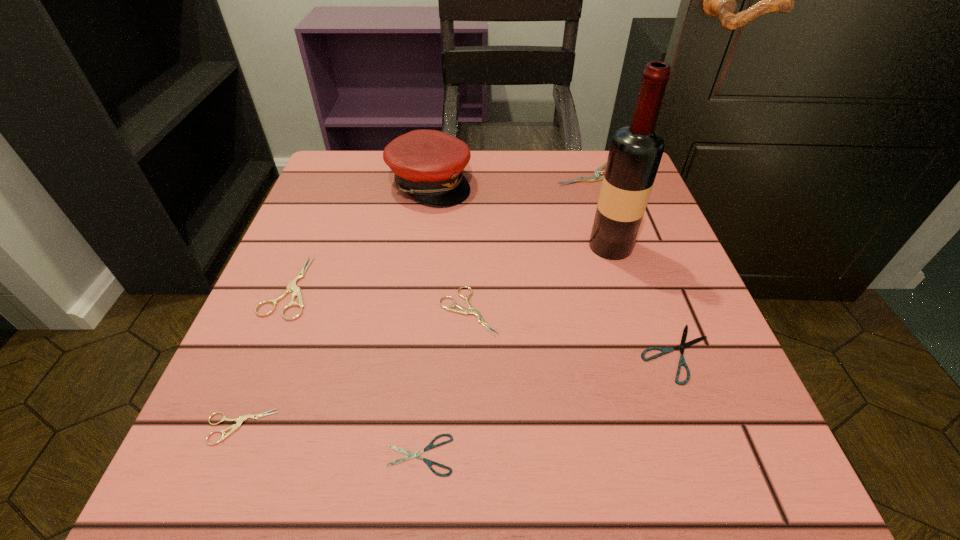
The height and width of the screenshot is (540, 960). Identify the location of vacant point at the near edge. (454, 502).

This screenshot has height=540, width=960. I want to click on blank space at the right edge, so click(638, 364).

I want to click on vacant area at the far left corner, so click(x=314, y=208).

Locate an element on the screen. Image resolution: width=960 pixels, height=540 pixels. vacant space at the near left corner of the desktop is located at coordinates (301, 450).

Locate an element on the screen. free space at the far right corner is located at coordinates (595, 158).

This screenshot has width=960, height=540. Identify the location of free space at the near right corner of the desktop. (688, 456).

Where is `free space between the bigger black shears and the tallest shears`? free space between the bigger black shears and the tallest shears is located at coordinates (636, 264).

Where is `vacant space that's between the wine bottle and the second tallest object`? vacant space that's between the wine bottle and the second tallest object is located at coordinates (520, 215).

At what (x,y) coordinates should I click in order to perform the action: click on free space between the smaller black shears and the tallest object. Please return your answer as a coordinate pair (x, y). This screenshot has width=960, height=540. Looking at the image, I should click on (516, 350).

Find the location of a particular element. empty location between the second tallest object and the smaller black shears is located at coordinates 425,319.